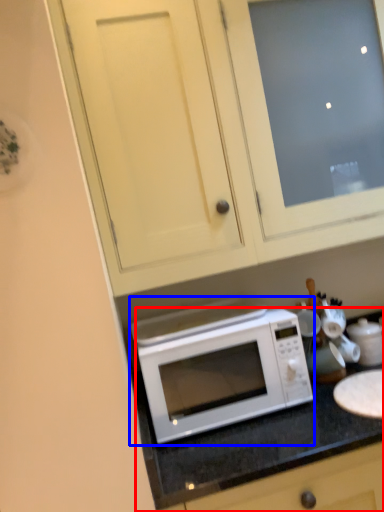
Question: Which point is further to the camera, counter (highlighted by a red box) or microwave oven (highlighted by a blue box)?

Choices:
 (A) counter
 (B) microwave oven

Answer: (B)